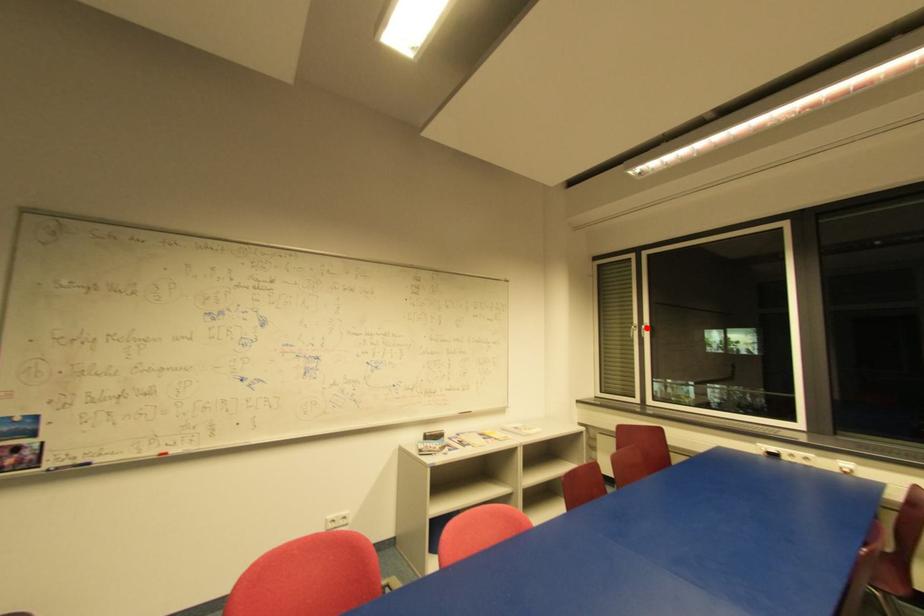
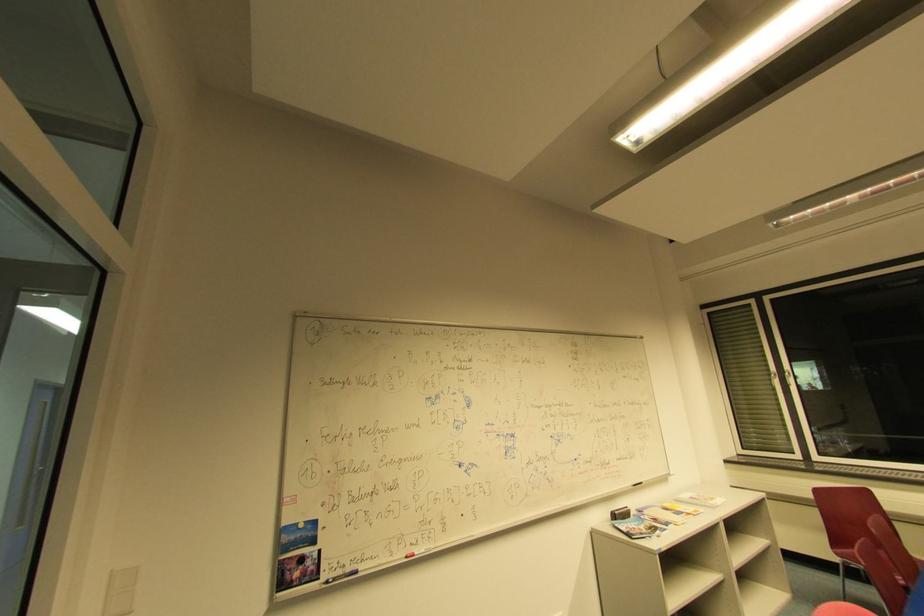
Question: I am providing you with two images of the same scene from different viewpoints. Given a red point in image1, look at the same physical point in image2. Is it:

Choices:
 (A) Closer to the viewpoint
 (B) Farther from the viewpoint

Answer: (A)